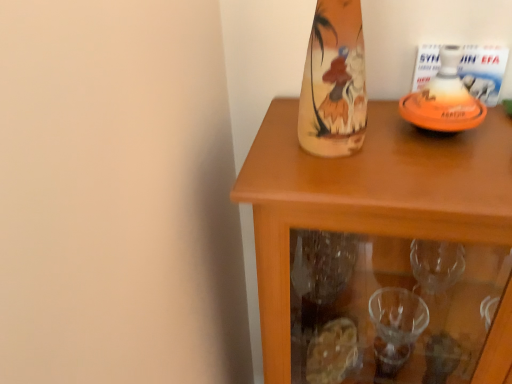
Where is `vacant region above wooden cabinet at upper right (from a real-world perspective)`? The image size is (512, 384). vacant region above wooden cabinet at upper right (from a real-world perspective) is located at coordinates [x=410, y=147].